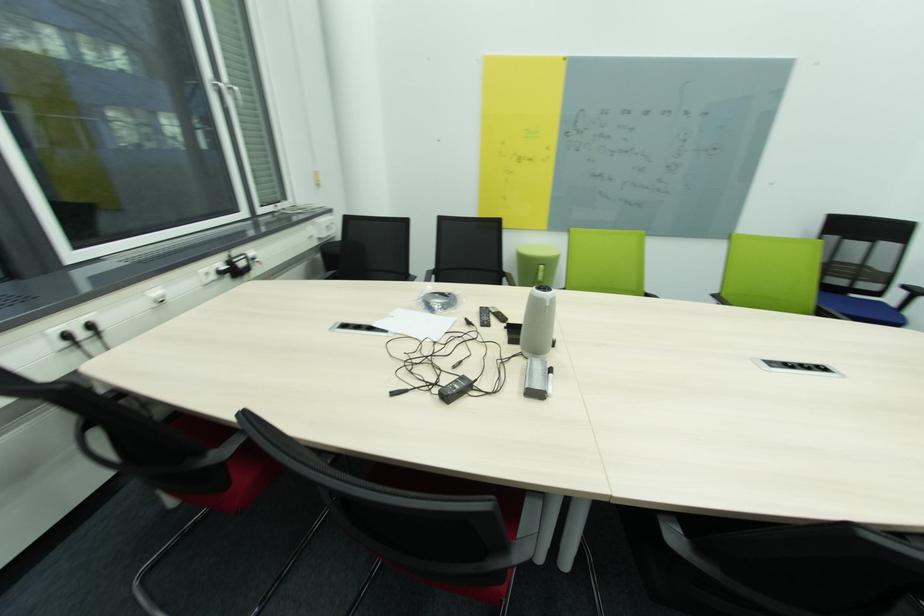
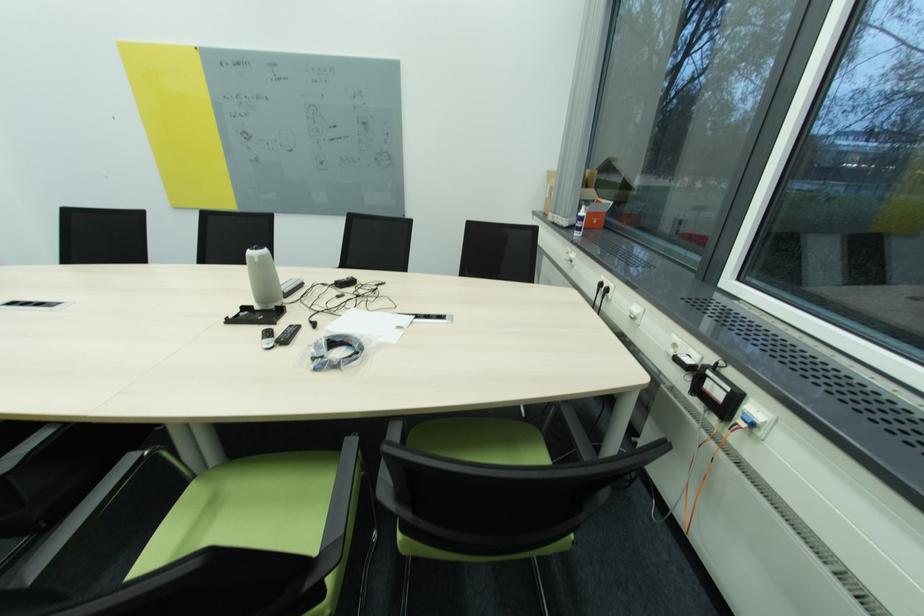
Find the pixel in the second image that matches point (212, 275) in the first image.

(679, 346)